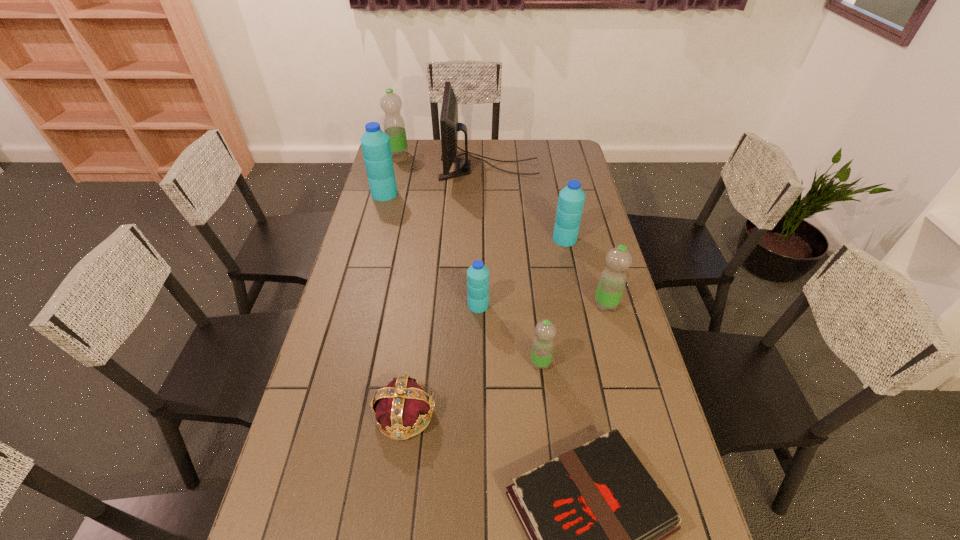
Find the location of a particular element. This screenshot has height=540, width=960. free space that satisfies the following two spatial constraints: 1. on the front side of the smallest blue water bottle; 2. on the right side of the farthest blue water bottle is located at coordinates (354, 305).

Locate an element on the screen. free space that satisfies the following two spatial constraints: 1. on the screen side of the nearest water bottle; 2. on the left side of the computer monitor is located at coordinates (494, 363).